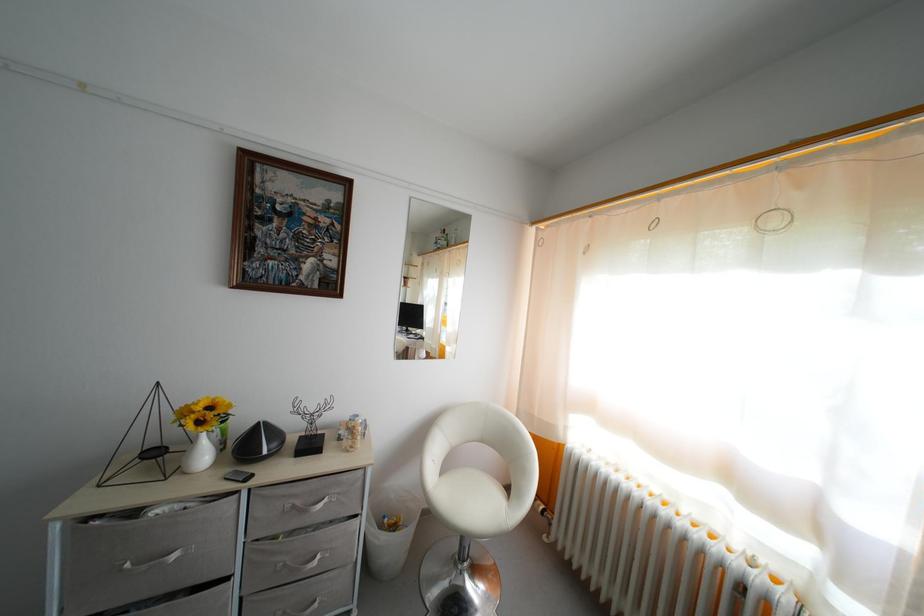
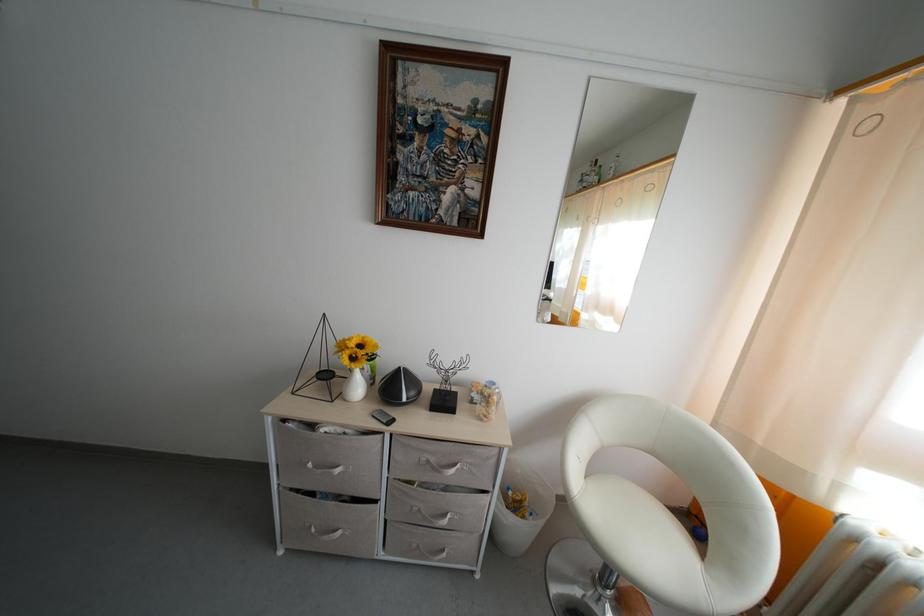
In the second image, find the point that corresponds to [358,437] in the first image.

(493, 406)